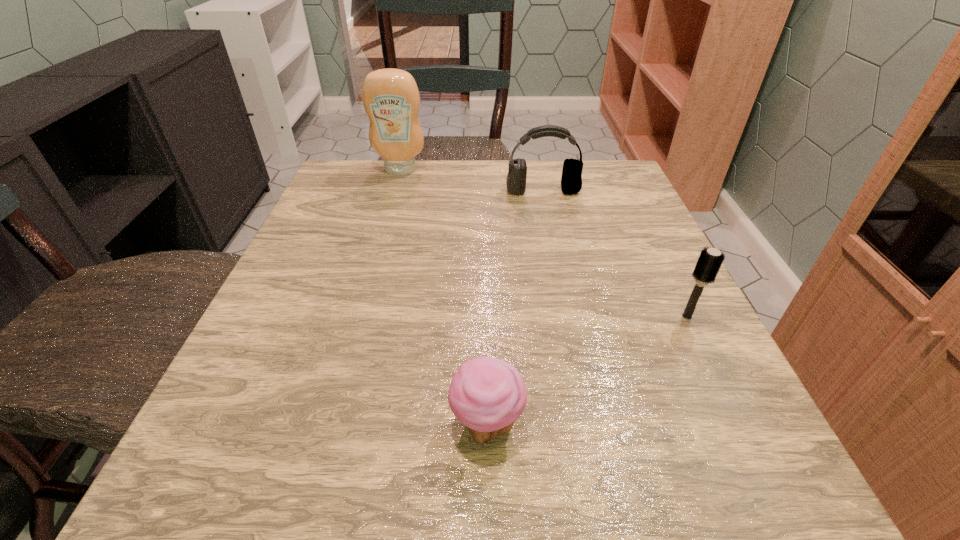
Find the location of a particular element. The height and width of the screenshot is (540, 960). free space in the image that satisfies the following two spatial constraints: 1. on the label of the condiment; 2. on the left side of the second object from left to right is located at coordinates (327, 425).

You are a GUI agent. You are given a task and a screenshot of the screen. Output one action in this format:
    pyautogui.click(x=<x>, y=<y>)
    Task: Click on the free space that satisfies the following two spatial constraints: 1. on the label of the shortest object; 2. on the right side of the farthest object
    The image size is (960, 540).
    Given the screenshot: What is the action you would take?
    pyautogui.click(x=327, y=425)

In order to click on vacant space that satisfies the following two spatial constraints: 1. on the label of the leftmost object; 2. on the right side of the shortest object in this screenshot , I will do `click(327, 425)`.

At what (x,y) coordinates should I click in order to perform the action: click on vacant space that satisfies the following two spatial constraints: 1. on the label of the nearest object; 2. on the right side of the tallest object. Please return your answer as a coordinate pair (x, y). This screenshot has width=960, height=540. Looking at the image, I should click on (327, 425).

Identify the location of vacant area in the image that satisfies the following two spatial constraints: 1. on the label of the hairbrush; 2. on the right side of the condiment. (358, 316).